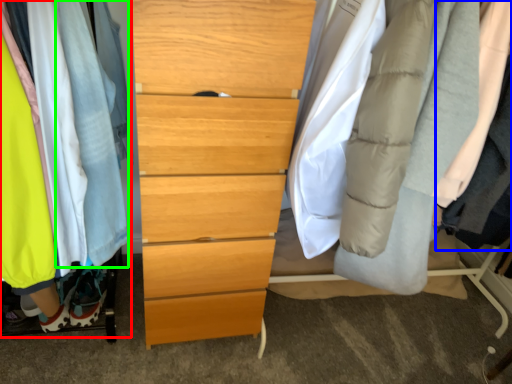
Question: Based on their relative distances, which object is nearer to closet (highlighted by a red box)? Choose from robe (highlighted by a blue box) and robe (highlighted by a green box).

Choices:
 (A) robe
 (B) robe

Answer: (B)